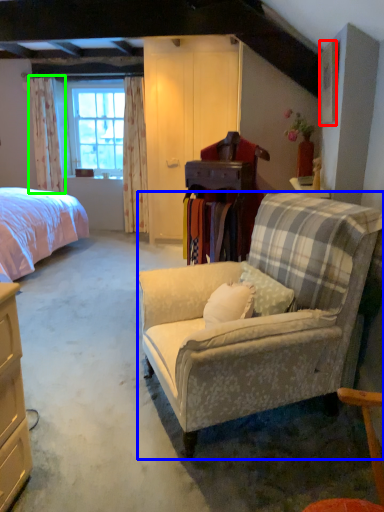
Question: Considering the real-world distances, which object is closest to picture frame (highlighted by a red box)? studio couch (highlighted by a blue box) or curtain (highlighted by a green box).

Choices:
 (A) studio couch
 (B) curtain

Answer: (A)